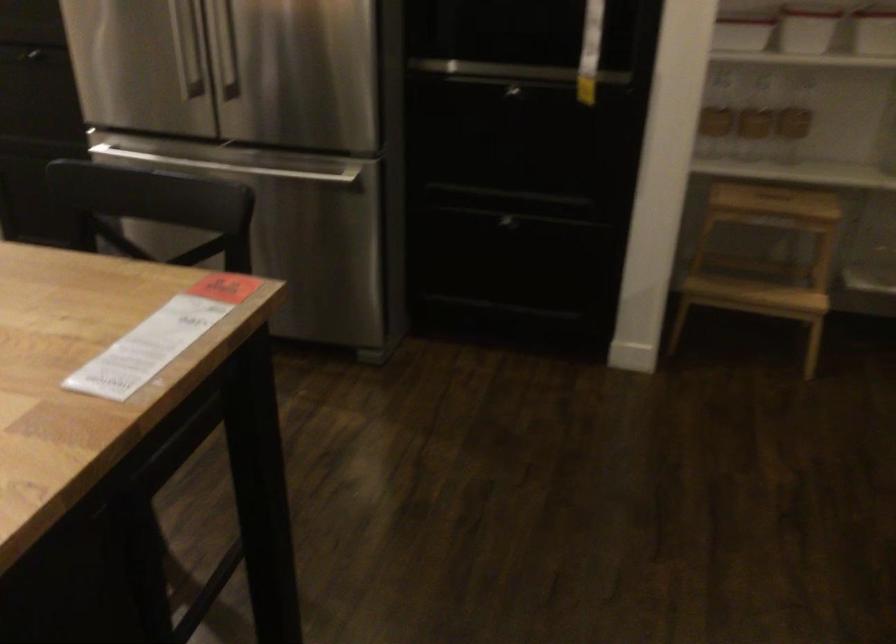
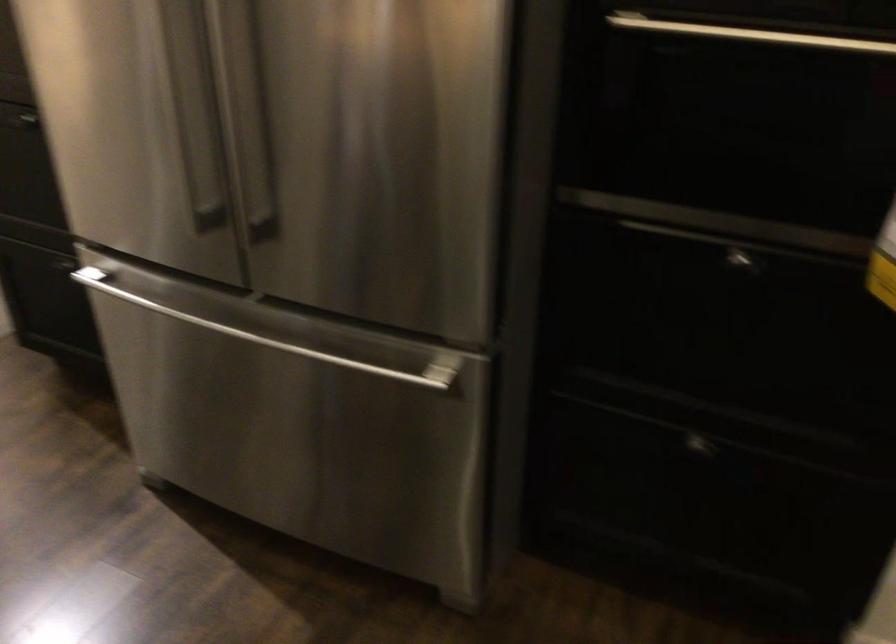
Question: The images are taken continuously from a first-person perspective. In which direction are you moving?

Choices:
 (A) Left
 (B) Right
 (C) Forward
 (D) Backward

Answer: (C)